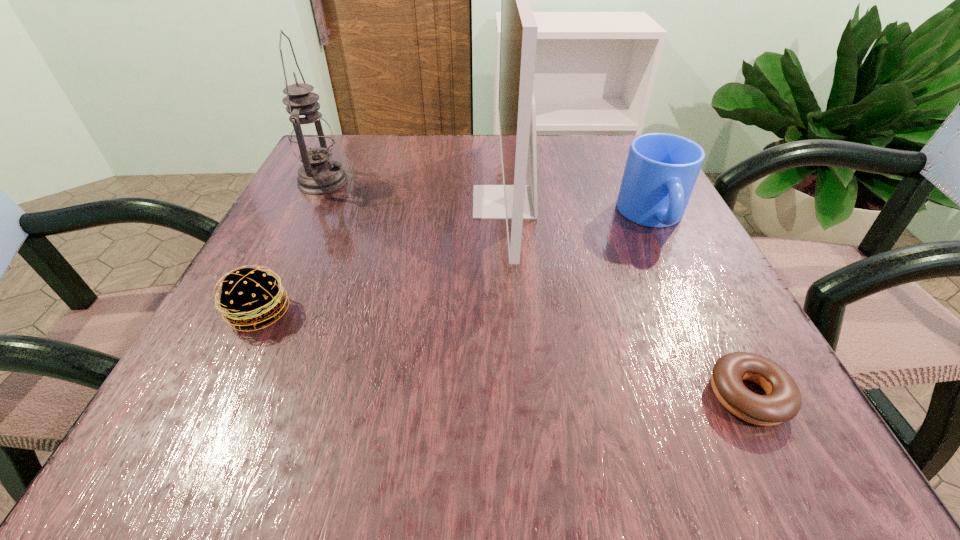
Where is `free space located on the right of the fourth shortest object`? This screenshot has height=540, width=960. free space located on the right of the fourth shortest object is located at coordinates (429, 181).

This screenshot has height=540, width=960. In order to click on blank space located on the side of the mug with the handle in this screenshot , I will do `click(682, 276)`.

This screenshot has width=960, height=540. What are the coordinates of `vacant region located 0.170m on the back of the patty` in the screenshot? It's located at (302, 225).

You are a GUI agent. You are given a task and a screenshot of the screen. Output one action in this format:
    pyautogui.click(x=<x>, y=<y>)
    Task: Click on the vacant region located on the back of the nearest object
    The width and height of the screenshot is (960, 540).
    Given the screenshot: What is the action you would take?
    pyautogui.click(x=658, y=217)

The image size is (960, 540). Identify the location of monitor that is positioned at the far edge. (514, 201).

The width and height of the screenshot is (960, 540). I want to click on oil lamp that is at the far edge, so click(311, 139).

The image size is (960, 540). In order to click on object that is at the near edge in this screenshot , I will do `click(783, 401)`.

Identify the location of oil lamp positioned at the left edge. pyautogui.click(x=311, y=139).

Identify the location of patty present at the left edge. The height and width of the screenshot is (540, 960). (252, 298).

This screenshot has height=540, width=960. In order to click on mug situated at the right edge in this screenshot , I will do tap(661, 170).